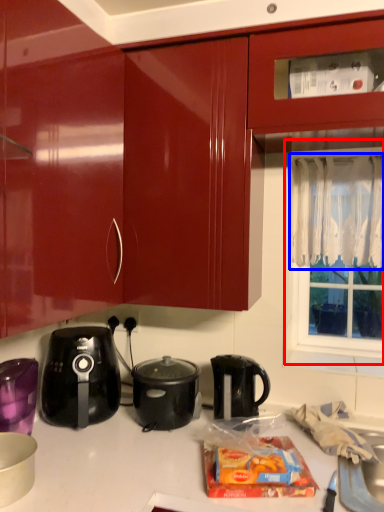
Question: Which object is closer to the camera taking this photo, window screen (highlighted by a red box) or curtain (highlighted by a blue box)?

Choices:
 (A) window screen
 (B) curtain

Answer: (B)